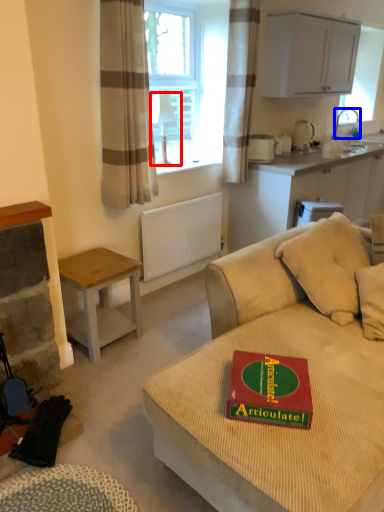
Question: Which object appears farthest to the camera in this image, lamp (highlighted by a red box) or faucet (highlighted by a blue box)?

Choices:
 (A) lamp
 (B) faucet

Answer: (B)